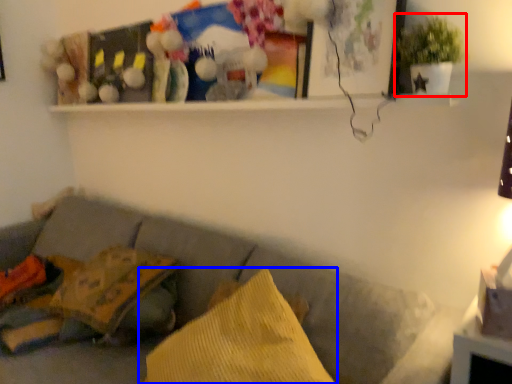
Question: Which object is closer to the camera taking this photo, houseplant (highlighted by a red box) or pillow (highlighted by a blue box)?

Choices:
 (A) houseplant
 (B) pillow

Answer: (B)